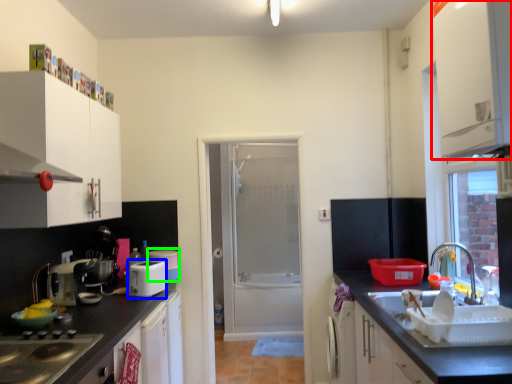
Question: Estimate the real-world distances between objects in this image. Which object is closer to cabinetry (highlighted by a red box), appliance (highlighted by a blue box) or appliance (highlighted by a green box)?

Choices:
 (A) appliance
 (B) appliance

Answer: (A)